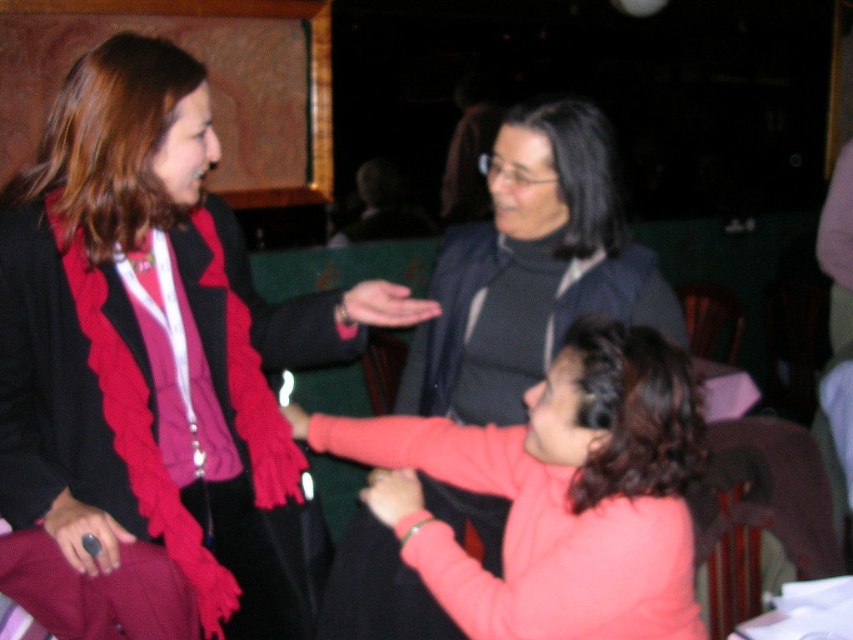
Question: Does pink fleece sweater at center appear over matte pink sweater at center?

Choices:
 (A) no
 (B) yes

Answer: (B)

Question: Can you confirm if pink fleece sweater at center is positioned below matte pink sweater at center?

Choices:
 (A) no
 (B) yes

Answer: (A)

Question: Which point is closer to the camera?

Choices:
 (A) matte pink sweater at center
 (B) matte black jacket at center

Answer: (B)

Question: Which object is closer to the camera taking this photo?

Choices:
 (A) pink fleece sweater at center
 (B) matte pink sweater at center
 (C) matte black jacket at center

Answer: (A)

Question: Estimate the real-world distances between objects in this image. Which object is farther from the matte pink sweater at center?

Choices:
 (A) pink fleece sweater at center
 (B) matte black jacket at center

Answer: (B)

Question: From the image, what is the correct spatial relationship of matte black jacket at center in relation to pink fleece sweater at center?

Choices:
 (A) left
 (B) right

Answer: (A)